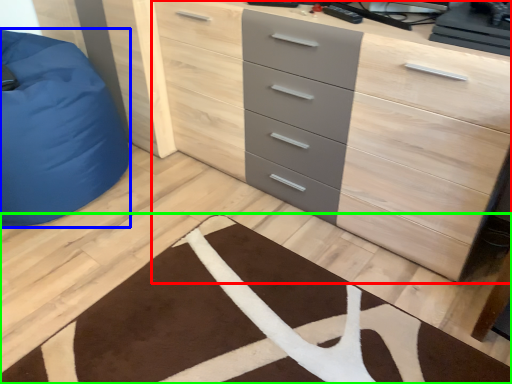
Question: Which is farther away from chest of drawers (highlighted by a red box)? furniture (highlighted by a blue box) or doormat (highlighted by a green box)?

Choices:
 (A) furniture
 (B) doormat

Answer: (A)